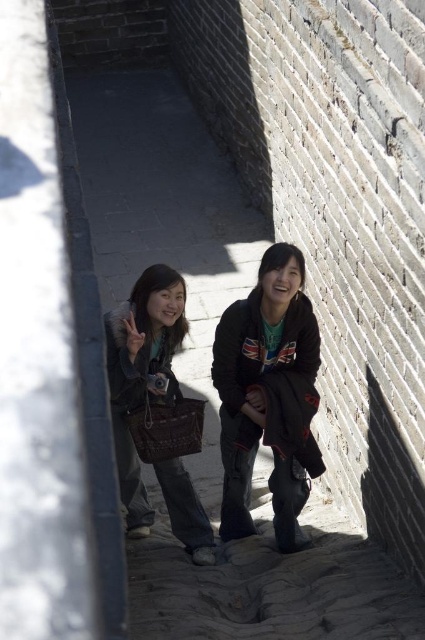
You are a fashion designer observing two jackets, the dark brown leather jacket at center and the matte brown jacket at center, worn by a person in the image. Which jacket is positioned lower on the person?

The dark brown leather jacket at center is positioned lower because it is below the matte brown jacket at center.

Looking at this image, you are standing at the point labeled point (266, 397) and want to walk to the point labeled point (129, 534) along the stone pathway. Which direction should you move relative to the camera view?

You should move downward and to the right relative to the camera view because point (129, 534) is located lower and to the right compared to point (266, 397) in the camera view.